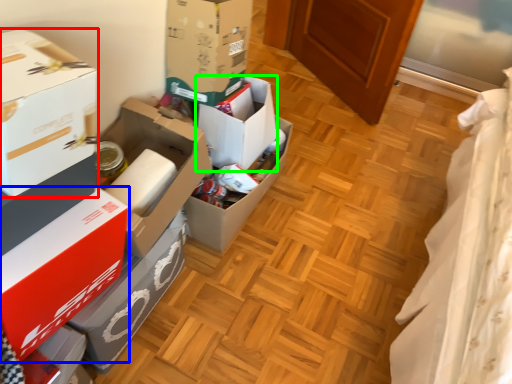
Question: Estimate the real-world distances between objects in this image. Which object is farther from box (highlighted by a red box), box (highlighted by a blue box) or box (highlighted by a green box)?

Choices:
 (A) box
 (B) box

Answer: (B)